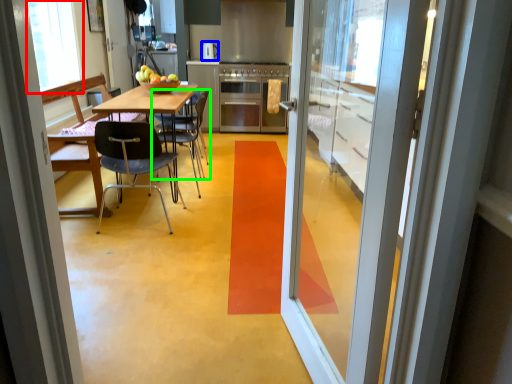
Question: Estimate the real-world distances between objects in this image. Which object is closer to window screen (highlighted by a red box), appliance (highlighted by a blue box) or chair (highlighted by a green box)?

Choices:
 (A) appliance
 (B) chair

Answer: (B)